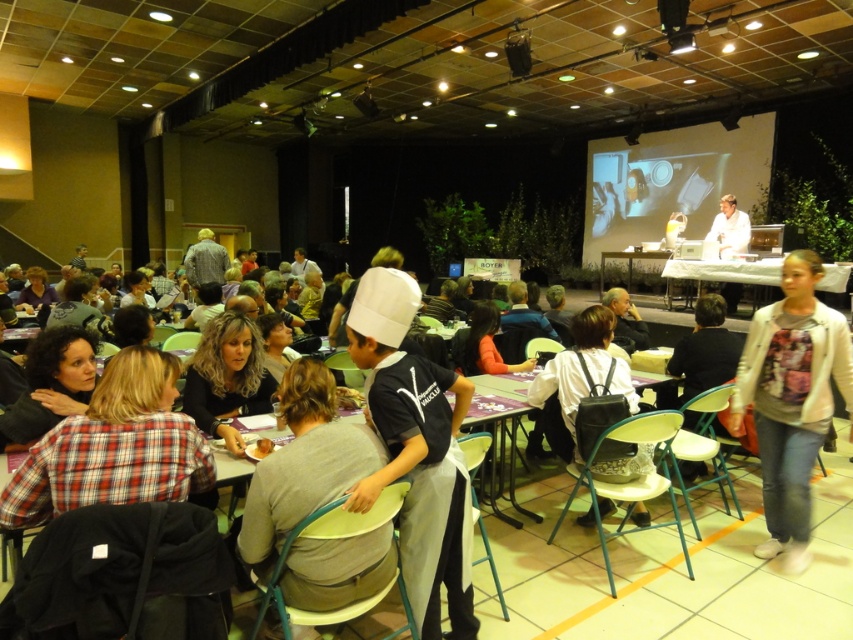
Question: Where is white cotton jacket at lower right located in relation to matte white projector screen at upper right in the image?

Choices:
 (A) right
 (B) left

Answer: (B)

Question: Among these points, which one is nearest to the camera?

Choices:
 (A) (416, 554)
 (B) (64, 356)

Answer: (A)

Question: Which of the following is the farthest from the observer?

Choices:
 (A) (757, 260)
 (B) (294, 580)

Answer: (A)

Question: Which object is positioned farthest from the white fabric shirt at center?

Choices:
 (A) white plastic table at center
 (B) gray fabric shirt at center

Answer: (B)

Question: Can you confirm if black backpack at center is positioned to the left of dark brown hair at center?

Choices:
 (A) no
 (B) yes

Answer: (A)

Question: Does black backpack at center have a smaller size compared to dark brown hair at center?

Choices:
 (A) no
 (B) yes

Answer: (A)